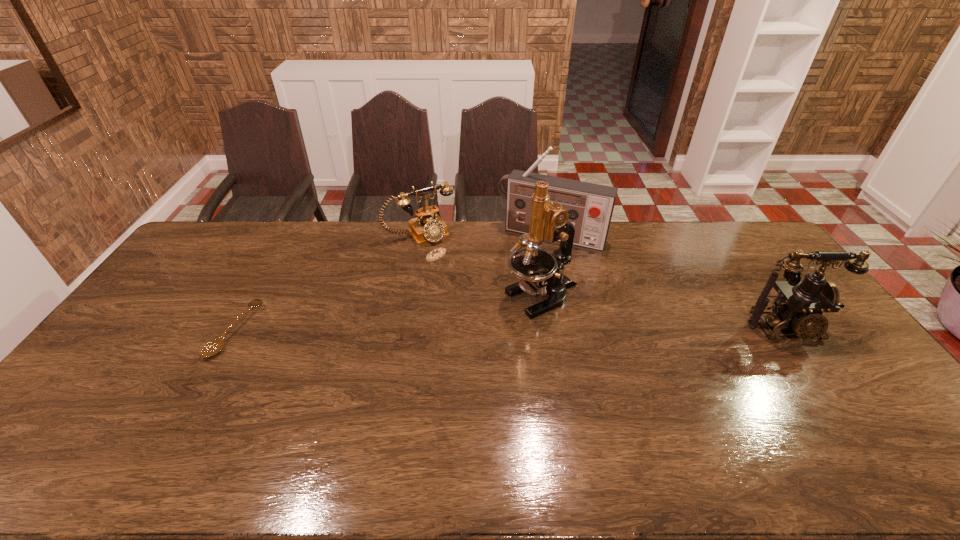
The height and width of the screenshot is (540, 960). I want to click on free space between the rightmost object and the tallest object, so click(x=664, y=313).

Where is `empty space that is in between the second tallest object and the right telephone`? This screenshot has height=540, width=960. empty space that is in between the second tallest object and the right telephone is located at coordinates (668, 282).

Where is `unoccupied position between the nearer telephone and the tallest object`? This screenshot has height=540, width=960. unoccupied position between the nearer telephone and the tallest object is located at coordinates (664, 313).

Locate an element on the screen. The image size is (960, 540). vacant space in between the fourth tallest object and the ladle is located at coordinates (327, 282).

In order to click on free spot between the ladle and the microscope in this screenshot , I will do `click(389, 314)`.

Identify which object is the nearest to the microscope. Please provide its 2D coordinates. Your answer should be formatted as a tuple, i.e. [(x, y)], where the tuple contains the x and y coordinates of a point satisfying the conditions above.

[(590, 206)]

At what (x,y) coordinates should I click in order to perform the action: click on object that is the second closest to the leftmost object. Please return your answer as a coordinate pair (x, y). Looking at the image, I should click on (541, 272).

The width and height of the screenshot is (960, 540). Identify the location of free location that satisfies the following two spatial constraints: 1. on the back side of the radio receiver; 2. on the right side of the microscope. (533, 235).

At what (x,y) coordinates should I click in order to perform the action: click on free space that satisfies the following two spatial constraints: 1. on the back side of the left telephone; 2. on the right side of the ladle. Please return your answer as a coordinate pair (x, y). This screenshot has width=960, height=540. Looking at the image, I should click on (289, 234).